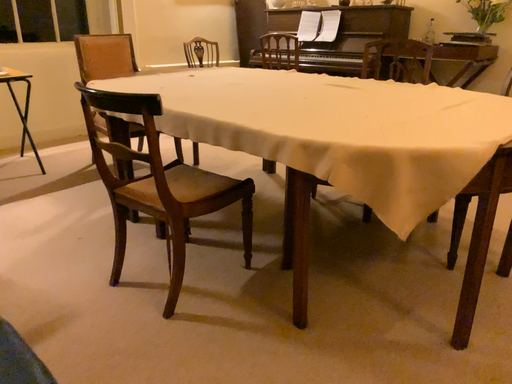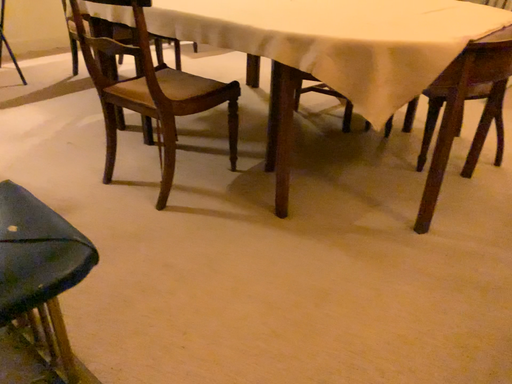
Question: Which way did the camera rotate in the video?

Choices:
 (A) rotated upward
 (B) rotated downward

Answer: (B)